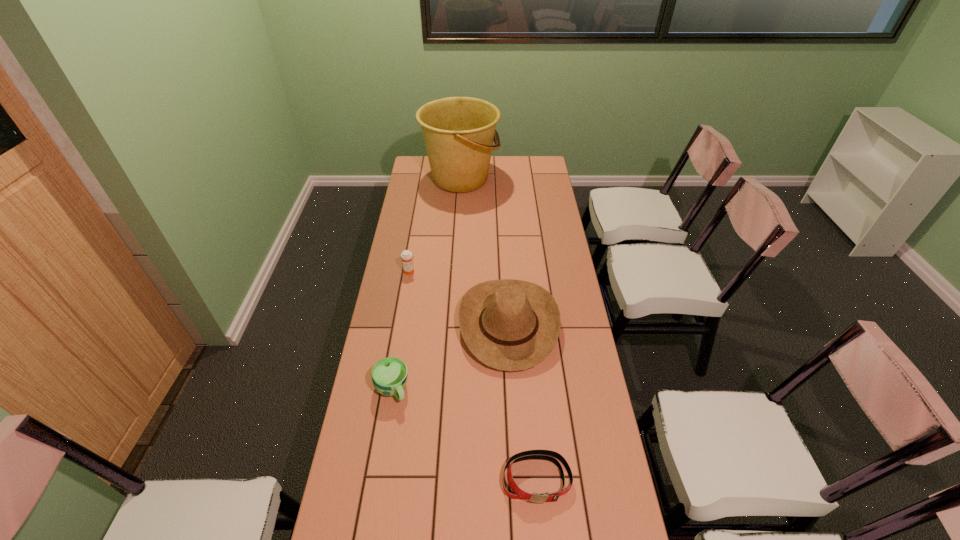
This screenshot has width=960, height=540. In order to click on free space between the fourth shortest object and the dog collar in this screenshot , I will do `click(522, 402)`.

The width and height of the screenshot is (960, 540). In order to click on free space that is in between the cup and the cowboy hat in this screenshot , I will do `click(450, 357)`.

In order to click on free space between the second farthest object and the dog collar in this screenshot , I will do 473,375.

At what (x,y) coordinates should I click in order to perform the action: click on empty space that is in between the dog collar and the cowboy hat. Please return your answer as a coordinate pair (x, y). Looking at the image, I should click on (522, 402).

Point out which object is positioned as the second nearest to the dog collar. Please provide its 2D coordinates. Your answer should be formatted as a tuple, i.e. [(x, y)], where the tuple contains the x and y coordinates of a point satisfying the conditions above.

[(389, 375)]

The image size is (960, 540). Find the location of `object that can be found as the fourth closest to the cup`. object that can be found as the fourth closest to the cup is located at coordinates (458, 132).

This screenshot has height=540, width=960. What are the coordinates of `free space that satisfies the following two spatial constraints: 1. on the back side of the shortest object; 2. on the front-facing side of the second tallest object` in the screenshot? It's located at (522, 325).

Find the location of a particular element. The image size is (960, 540). vacant area in the image that satisfies the following two spatial constraints: 1. on the front side of the cup; 2. on the left side of the medicine is located at coordinates (390, 389).

You are a GUI agent. You are given a task and a screenshot of the screen. Output one action in this format:
    pyautogui.click(x=<x>, y=<y>)
    Task: Click on the vacant space that satisfies the following two spatial constraints: 1. on the front-facing side of the cowboy hat; 2. on the left side of the dog collar
    
    Given the screenshot: What is the action you would take?
    pyautogui.click(x=517, y=478)

At what (x,y) coordinates should I click in order to perform the action: click on free space in the image that satisfies the following two spatial constraints: 1. on the back side of the shortest object; 2. on the side of the farthest object with the handle. Please return your answer as a coordinate pair (x, y). Looking at the image, I should click on (510, 179).